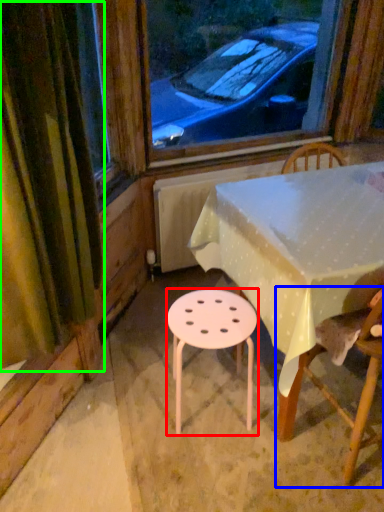
Question: Which is nearer to the stool (highlighted by a red box)? chair (highlighted by a blue box) or curtain (highlighted by a green box).

Choices:
 (A) chair
 (B) curtain

Answer: (A)